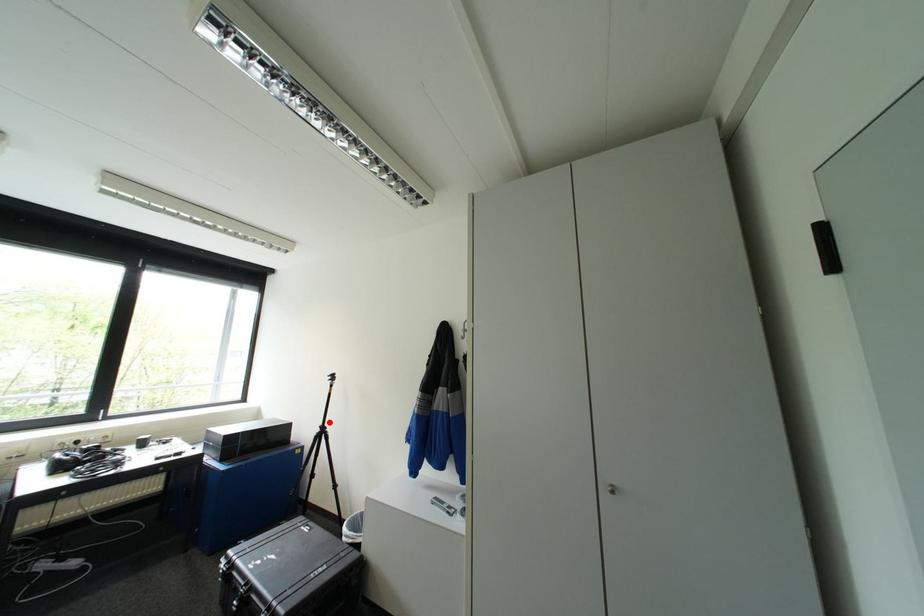
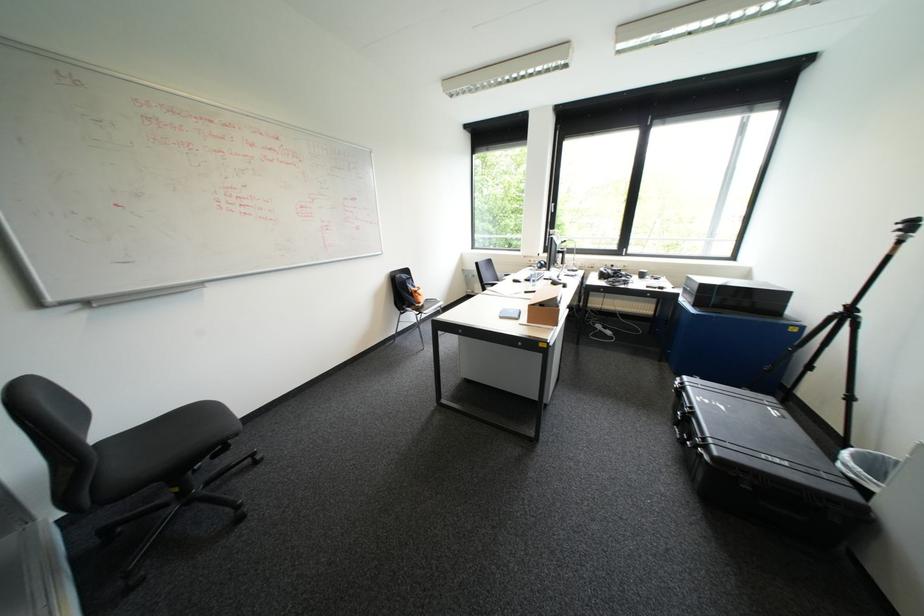
Question: I am providing you with two images of the same scene from different viewpoints. Image1 has a red point marked. In image2, the corresponding 3D location appears at what relative position? Reply with the corresponding letter.

Choices:
 (A) Closer
 (B) Farther

Answer: (A)